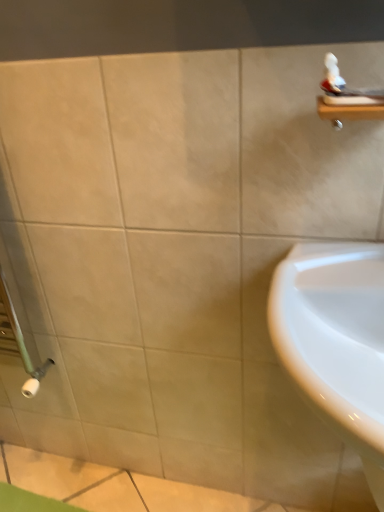
Question: Considering the relative sizes of wooden shelf at upper right and white glossy sink at lower right in the image provided, is wooden shelf at upper right thinner than white glossy sink at lower right?

Choices:
 (A) yes
 (B) no

Answer: (A)

Question: Is wooden shelf at upper right smaller than white glossy sink at lower right?

Choices:
 (A) no
 (B) yes

Answer: (B)

Question: Is wooden shelf at upper right outside of white glossy sink at lower right?

Choices:
 (A) yes
 (B) no

Answer: (A)

Question: Is white glossy sink at lower right inside wooden shelf at upper right?

Choices:
 (A) no
 (B) yes

Answer: (A)

Question: Is wooden shelf at upper right at the left side of white glossy sink at lower right?

Choices:
 (A) no
 (B) yes

Answer: (A)

Question: Is wooden shelf at upper right at the right side of white glossy sink at lower right?

Choices:
 (A) no
 (B) yes

Answer: (B)

Question: Is white glossy sink at lower right next to wooden shelf at upper right?

Choices:
 (A) no
 (B) yes

Answer: (A)

Question: Considering the relative sizes of white glossy sink at lower right and wooden shelf at upper right in the image provided, is white glossy sink at lower right taller than wooden shelf at upper right?

Choices:
 (A) yes
 (B) no

Answer: (A)

Question: From the image's perspective, is white glossy sink at lower right located beneath wooden shelf at upper right?

Choices:
 (A) yes
 (B) no

Answer: (A)

Question: Is white glossy sink at lower right at the left side of wooden shelf at upper right?

Choices:
 (A) no
 (B) yes

Answer: (B)

Question: From the image's perspective, is white glossy sink at lower right over wooden shelf at upper right?

Choices:
 (A) no
 (B) yes

Answer: (A)

Question: Would you say white glossy sink at lower right is a long distance from wooden shelf at upper right?

Choices:
 (A) yes
 (B) no

Answer: (B)

Question: Does point (349, 361) appear closer or farther from the camera than point (380, 109)?

Choices:
 (A) closer
 (B) farther

Answer: (B)